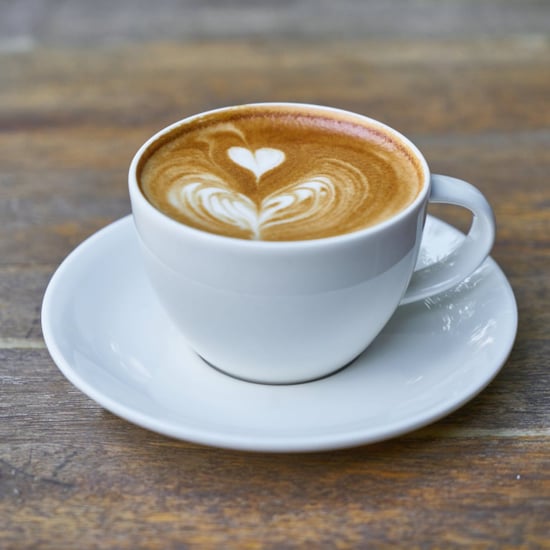
Identify the location of groove in table. (514, 438), (31, 342).